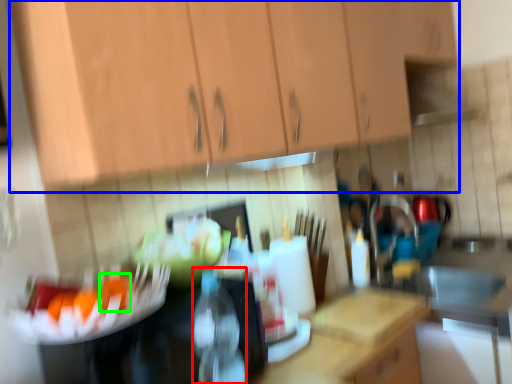
Question: Considering the real-world distances, which object is closest to bottle (highlighted by a red box)? cabinetry (highlighted by a blue box) or food (highlighted by a green box).

Choices:
 (A) cabinetry
 (B) food

Answer: (B)